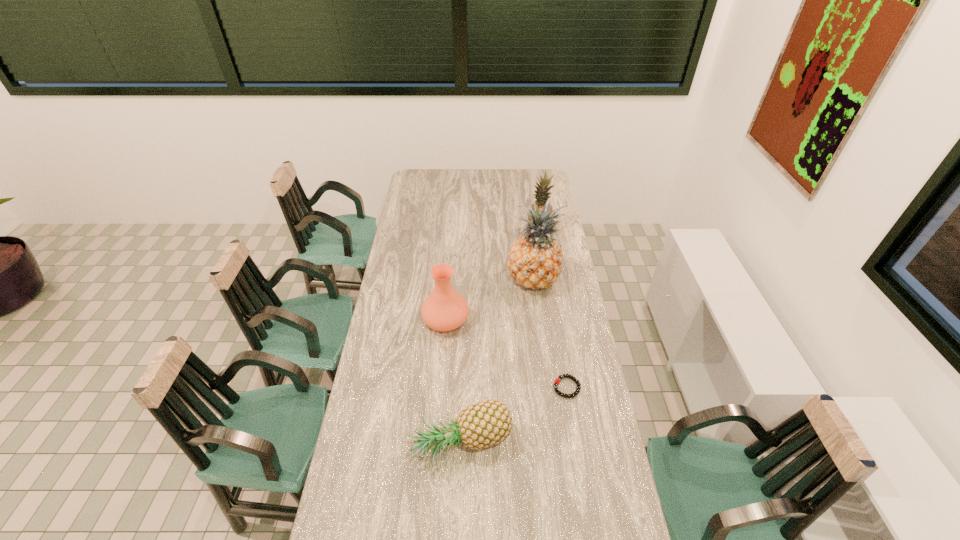
Locate an element on the screen. This screenshot has height=540, width=960. the second farthest pineapple is located at coordinates (535, 259).

Where is `the fourth shortest object`? The image size is (960, 540). the fourth shortest object is located at coordinates (541, 194).

Where is `the farthest pineapple`? the farthest pineapple is located at coordinates (541, 194).

Find the location of a particular element. the third farthest object is located at coordinates (444, 310).

Find the location of a particular element. The width and height of the screenshot is (960, 540). the third tallest object is located at coordinates (x=444, y=310).

Where is `the leftmost pineapple`? the leftmost pineapple is located at coordinates (483, 424).

This screenshot has width=960, height=540. In order to click on the second shortest object in this screenshot , I will do `click(483, 424)`.

You are a GUI agent. You are given a task and a screenshot of the screen. Output one action in this format:
    pyautogui.click(x=<x>, y=<y>)
    Task: Click on the bracelet
    The width and height of the screenshot is (960, 540).
    Given the screenshot: What is the action you would take?
    pyautogui.click(x=557, y=380)

Locate an element on the screen. The width and height of the screenshot is (960, 540). the shortest object is located at coordinates [x=557, y=380].

Where is `vacant region located on the front of the fourth nearest object`? vacant region located on the front of the fourth nearest object is located at coordinates (537, 310).